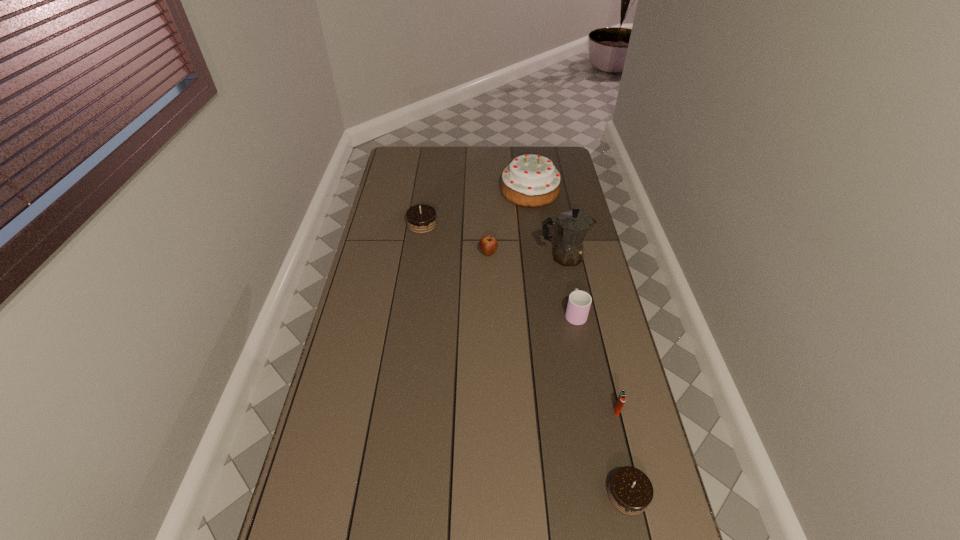
The width and height of the screenshot is (960, 540). In the image, there is a desktop. What are the coordinates of `vacant space at the near right corner` in the screenshot? It's located at (654, 530).

The image size is (960, 540). Identify the location of empty space that is in between the second nearest object and the leftmost object. (519, 318).

Locate an element on the screen. The width and height of the screenshot is (960, 540). vacant region between the tallest object and the third nearest object is located at coordinates (569, 285).

You are a GUI agent. You are given a task and a screenshot of the screen. Output one action in this format:
    pyautogui.click(x=<x>, y=<y>)
    Task: Click on the vacant space that is in between the igniter and the farther chocolate cake
    
    Given the screenshot: What is the action you would take?
    pyautogui.click(x=519, y=318)

You are a GUI agent. You are given a task and a screenshot of the screen. Output one action in this format:
    pyautogui.click(x=<x>, y=<y>)
    Task: Click on the vacant area between the left chocolate cake and the igniter
    The height and width of the screenshot is (540, 960).
    Given the screenshot: What is the action you would take?
    pyautogui.click(x=519, y=318)

Find the location of a particular element. vacant point located between the third nearest object and the taller chocolate cake is located at coordinates (499, 269).

Identify the location of free space between the coffeepot and the cup. The width and height of the screenshot is (960, 540). (569, 285).

Locate an element on the screen. The image size is (960, 540). blank region between the tallest object and the second nearest object is located at coordinates (590, 334).

Identify which object is located as the sixth nearest to the coffeepot. Please provide its 2D coordinates. Your answer should be formatted as a tuple, i.e. [(x, y)], where the tuple contains the x and y coordinates of a point satisfying the conditions above.

[(630, 491)]

You are a GUI agent. You are given a task and a screenshot of the screen. Output one action in this format:
    pyautogui.click(x=<x>, y=<y>)
    Task: Click on the second closest object to the nearest object
    
    Given the screenshot: What is the action you would take?
    pyautogui.click(x=579, y=302)